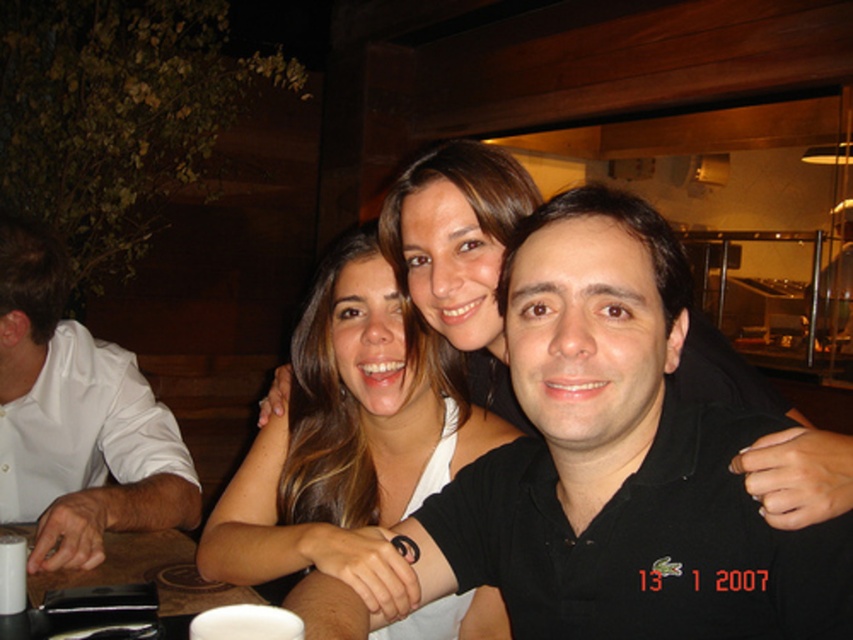
You are a photographer trying to capture a candid shot of the smooth white tank top at center and the white matte table at lower left. Based on their positions, which object is closer to the right edge of the frame?

The smooth white tank top at center is positioned on the right side of the white matte table at lower left, so it is closer to the right edge of the frame.

You are a waiter in a restaurant. You need to deliver a drink to the white glossy cup at left. Where should you place the drink?

The white glossy cup at left is located at point 2D coordinates of (76, 419), so you should place the drink there.

You are a barista trying to serve two customers. You have a large coffee cup and a small espresso cup. The white glossy cup at left is for the customer on the left, and the white matte cup at lower center is for the one in the center. Which cup should you fill with the larger coffee order?

The white glossy cup at left is bigger than the white matte cup at lower center, so you should fill the white glossy cup at left with the larger coffee order.